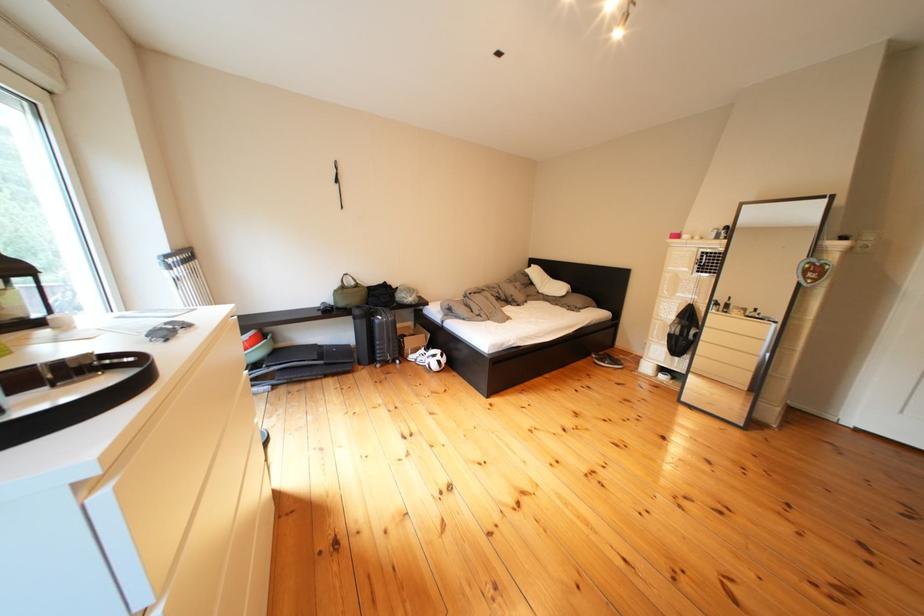
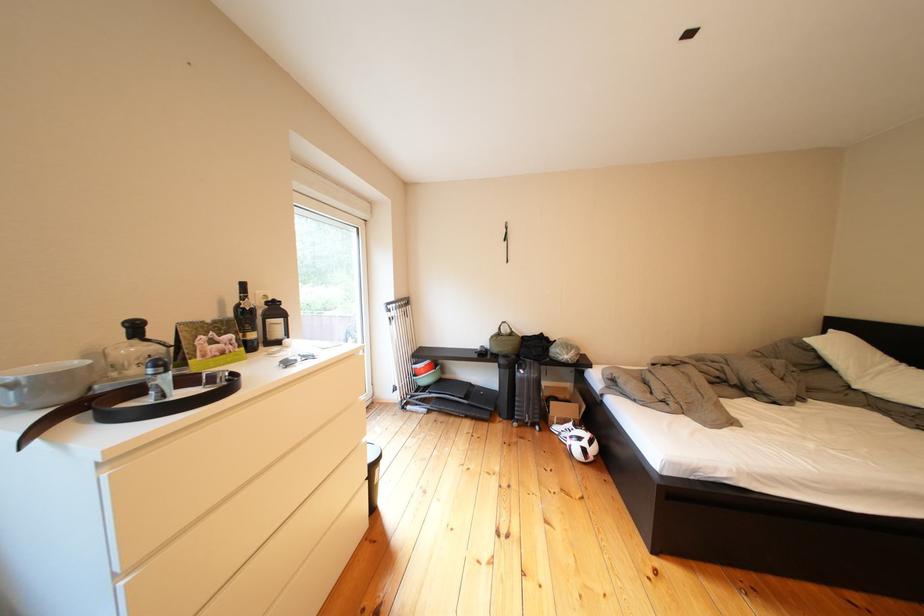
Locate, in the second image, the point that corresponds to [427,361] in the first image.

(570, 432)